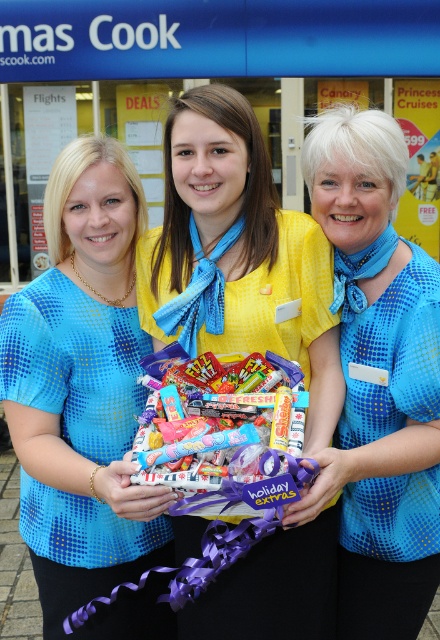
Is point (256, 221) more distant than point (267, 381)?

Yes.

Is yellow fabric shirt at center bigger than shiny plastic candy at center?

Yes.

Between point (187, 618) and point (198, 472), which one is positioned behind?

The point (187, 618) is behind.

Locate an element on the screen. This screenshot has width=440, height=640. yellow fabric shirt at center is located at coordinates (238, 253).

Does matte blue blouse at center appear on the left side of blue dotted shirt at center?

Indeed, matte blue blouse at center is positioned on the left side of blue dotted shirt at center.

Is matte blue blouse at center positioned at the back of blue dotted shirt at center?

That is True.

Does point (73, 554) come closer to viewer compared to point (381, 333)?

No, (73, 554) is behind (381, 333).

In order to click on matte blue blouse at center in this screenshot , I will do `click(81, 387)`.

Is point (96, 577) closer to viewer compared to point (206, 408)?

No.

Does matte blue blouse at center have a greater width compared to shiny plastic candy at center?

Yes.

The height and width of the screenshot is (640, 440). In order to click on matte blue blouse at center in this screenshot , I will do `click(81, 387)`.

Identify the location of matte blue blouse at center. (81, 387).